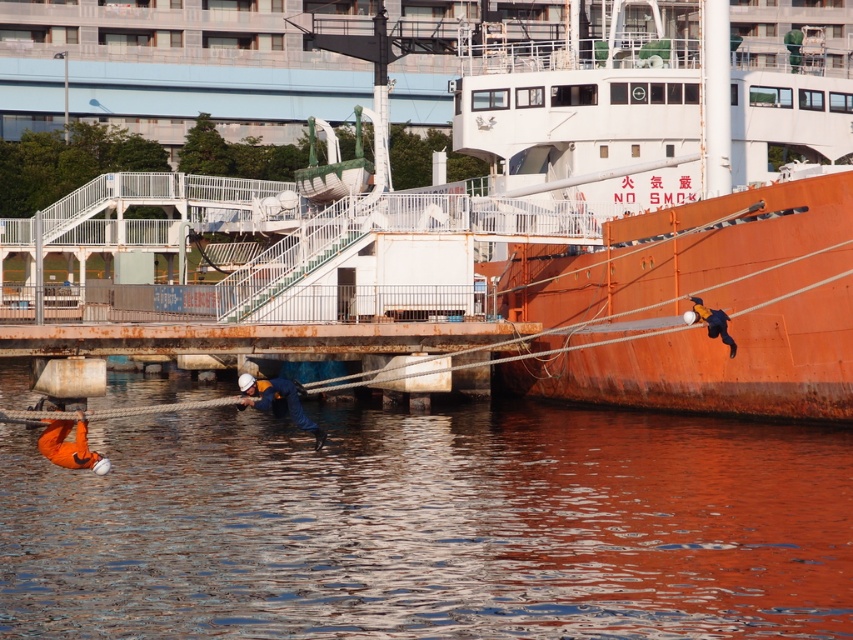
Question: Which of the following is the closest to the observer?

Choices:
 (A) smooth water at lower left
 (B) orange fabric helmet at lower center

Answer: (A)

Question: Is smooth water at lower left wider than orange life vest at lower left?

Choices:
 (A) no
 (B) yes

Answer: (B)

Question: Does orange life vest at lower left appear on the left side of blue fabric jacket at right?

Choices:
 (A) yes
 (B) no

Answer: (A)

Question: Which point is farther to the camera?

Choices:
 (A) (x=618, y=502)
 (B) (x=62, y=428)
 (C) (x=724, y=324)

Answer: (C)

Question: Observing the image, what is the correct spatial positioning of orange life vest at lower left in reference to blue fabric jacket at right?

Choices:
 (A) above
 (B) below

Answer: (B)

Question: Which point appears closest to the camera in this image?

Choices:
 (A) (44, 435)
 (B) (33, 605)
 (C) (730, 342)
 (D) (280, 410)

Answer: (B)